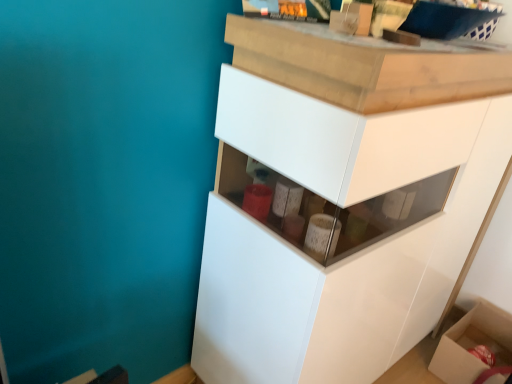
Find the location of `white glossy cabinet at center`. white glossy cabinet at center is located at coordinates tap(349, 256).

Describe the element at coordinates (349, 256) in the screenshot. The width and height of the screenshot is (512, 384). I see `white glossy cabinet at center` at that location.

Describe the element at coordinates (473, 344) in the screenshot. This screenshot has width=512, height=384. I see `cardboard box at lower right` at that location.

The width and height of the screenshot is (512, 384). Identify the location of cardboard box at lower right. (473, 344).

You are a GUI agent. You are given a task and a screenshot of the screen. Output one action in this format:
    pyautogui.click(x=<x>, y=<y>)
    Task: Click on the white glossy cabinet at center
    The image size is (512, 384).
    Given the screenshot: What is the action you would take?
    pyautogui.click(x=349, y=256)

Looking at this image, which object is positioned more to the left, white glossy cabinet at center or cardboard box at lower right?

white glossy cabinet at center is more to the left.

Considering the positions of objects white glossy cabinet at center and cardboard box at lower right in the image provided, who is in front, white glossy cabinet at center or cardboard box at lower right?

Positioned in front is white glossy cabinet at center.

Which is behind, point (298, 169) or point (439, 366)?

The point (439, 366) is behind.

From the image's perspective, is white glossy cabinet at center beneath cardboard box at lower right?

No.

From a real-world perspective, is white glossy cabinet at center physically located above or below cardboard box at lower right?

white glossy cabinet at center is situated higher than cardboard box at lower right in the real world.

Looking at their sizes, would you say white glossy cabinet at center is wider or thinner than cardboard box at lower right?

white glossy cabinet at center is wider than cardboard box at lower right.

Consider the image. Does white glossy cabinet at center have a greater height compared to cardboard box at lower right?

Correct, white glossy cabinet at center is much taller as cardboard box at lower right.

Considering the relative sizes of white glossy cabinet at center and cardboard box at lower right in the image provided, is white glossy cabinet at center smaller than cardboard box at lower right?

No.

Can we say white glossy cabinet at center lies outside cardboard box at lower right?

white glossy cabinet at center is positioned outside cardboard box at lower right.

Are white glossy cabinet at center and cardboard box at lower right located far from each other?

No, white glossy cabinet at center is not far from cardboard box at lower right.

Is white glossy cabinet at center aimed at cardboard box at lower right?

Yes, white glossy cabinet at center faces towards cardboard box at lower right.

How many degrees apart are the facing directions of white glossy cabinet at center and cardboard box at lower right?

88.4 degrees separate the facing orientations of white glossy cabinet at center and cardboard box at lower right.

How far apart are white glossy cabinet at center and cardboard box at lower right?

white glossy cabinet at center is 32.89 inches away from cardboard box at lower right.

I want to click on cabinetry above the cardboard box at lower right (from the image's perspective), so click(x=349, y=256).

Between cardboard box at lower right and white glossy cabinet at center, which one appears on the right side from the viewer's perspective?

Positioned to the right is cardboard box at lower right.

Considering the relative positions of cardboard box at lower right and white glossy cabinet at center in the image provided, is cardboard box at lower right in front of white glossy cabinet at center?

No, cardboard box at lower right is further to the viewer.

Which is in front, point (486, 325) or point (341, 283)?

Point (341, 283)

From the image's perspective, relative to white glossy cabinet at center, is cardboard box at lower right above or below?

cardboard box at lower right is situated lower than white glossy cabinet at center in the image.

From a real-world perspective, is cardboard box at lower right above or below white glossy cabinet at center?

From a real-world perspective, cardboard box at lower right is physically below white glossy cabinet at center.

Considering the sizes of cardboard box at lower right and white glossy cabinet at center in the image, is cardboard box at lower right wider or thinner than white glossy cabinet at center?

In the image, cardboard box at lower right appears to be more narrow than white glossy cabinet at center.

In terms of height, does cardboard box at lower right look taller or shorter compared to white glossy cabinet at center?

Clearly, cardboard box at lower right is shorter compared to white glossy cabinet at center.

In the scene shown: Is cardboard box at lower right bigger or smaller than white glossy cabinet at center?

Considering their sizes, cardboard box at lower right takes up less space than white glossy cabinet at center.

Would you say cardboard box at lower right contains white glossy cabinet at center?

Actually, white glossy cabinet at center is outside cardboard box at lower right.

Would you say cardboard box at lower right is a long distance from white glossy cabinet at center?

No, cardboard box at lower right is in close proximity to white glossy cabinet at center.

Is cardboard box at lower right aimed at white glossy cabinet at center?

No, cardboard box at lower right is not aimed at white glossy cabinet at center.

What's the angular difference between cardboard box at lower right and white glossy cabinet at center's facing directions?

The facing directions of cardboard box at lower right and white glossy cabinet at center are 88.4 degrees apart.

What are the coordinates of `cardboard box on the right side of white glossy cabinet at center` in the screenshot? It's located at (473, 344).

At what (x,y) coordinates should I click in order to perform the action: click on cardboard box below the white glossy cabinet at center (from the image's perspective). Please return your answer as a coordinate pair (x, y). This screenshot has height=384, width=512. Looking at the image, I should click on (473, 344).

You are a GUI agent. You are given a task and a screenshot of the screen. Output one action in this format:
    pyautogui.click(x=<x>, y=<y>)
    Task: Click on the cabinetry in front of the cardboard box at lower right
    This screenshot has height=384, width=512.
    Given the screenshot: What is the action you would take?
    pyautogui.click(x=349, y=256)